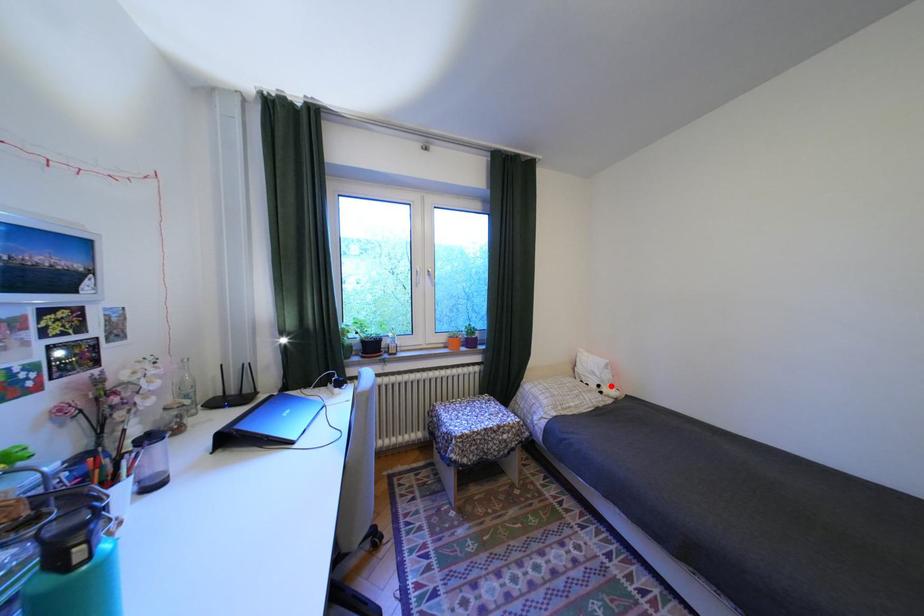
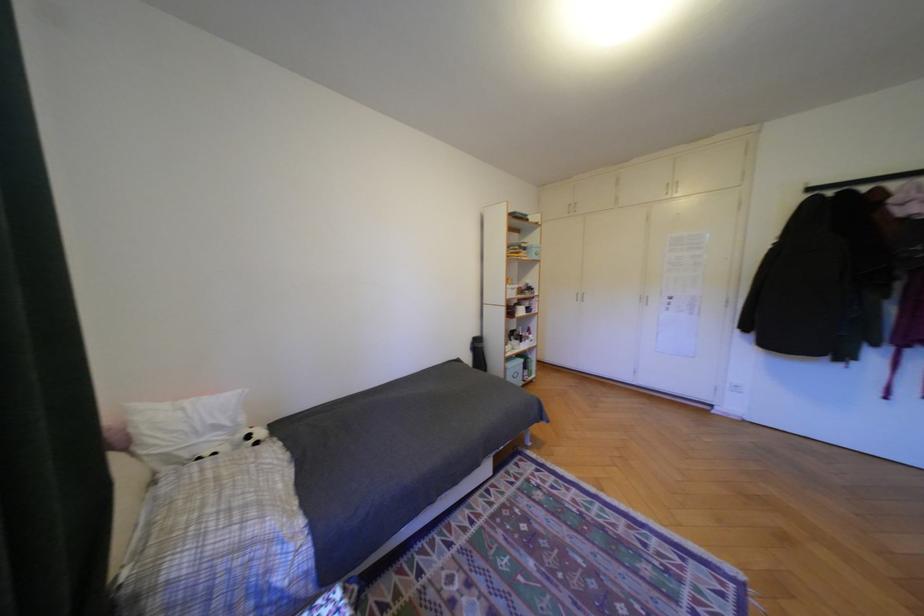
Where in the second image is the point corresponding to the highlighted location from the first image?

(261, 437)